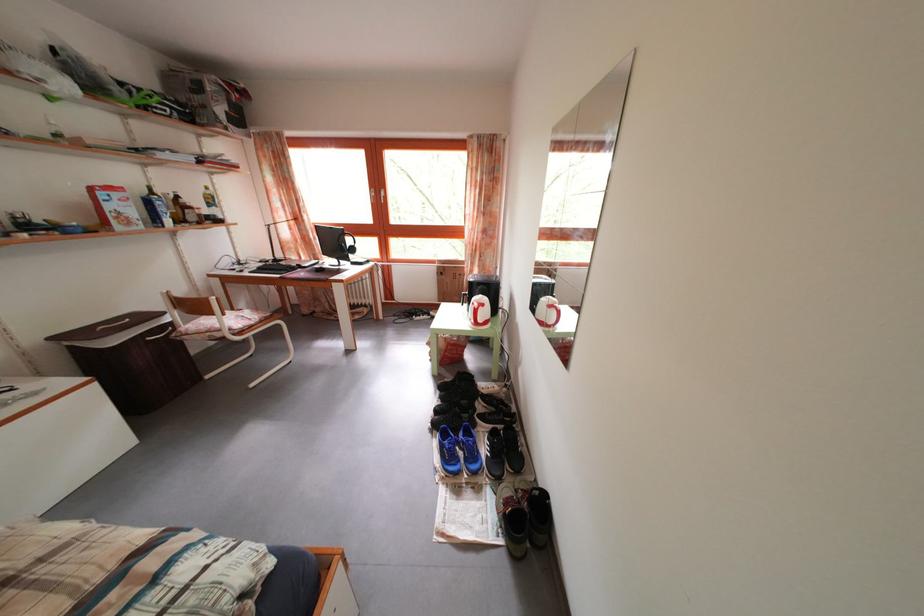
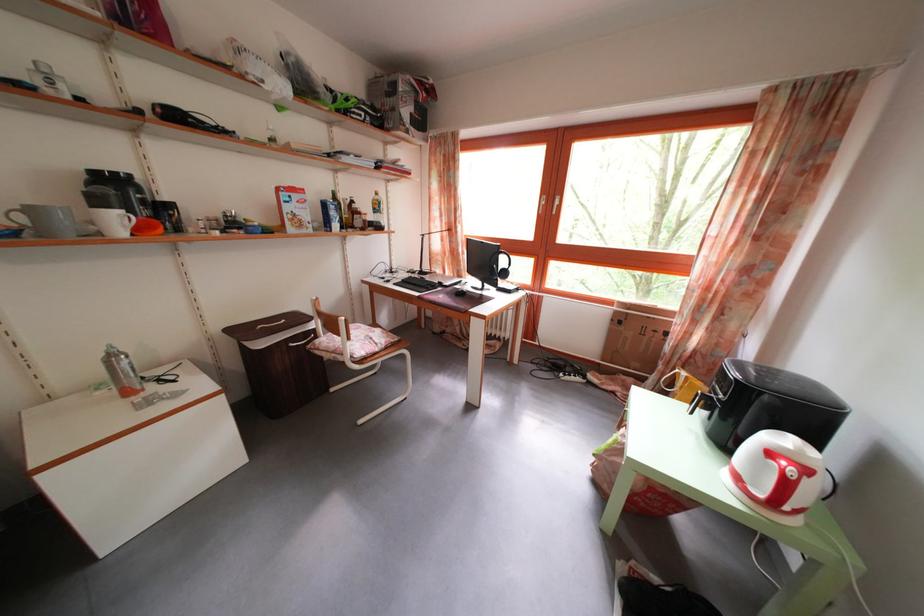
In the second image, find the point that corresponds to pixel 178 331 in the first image.

(322, 339)